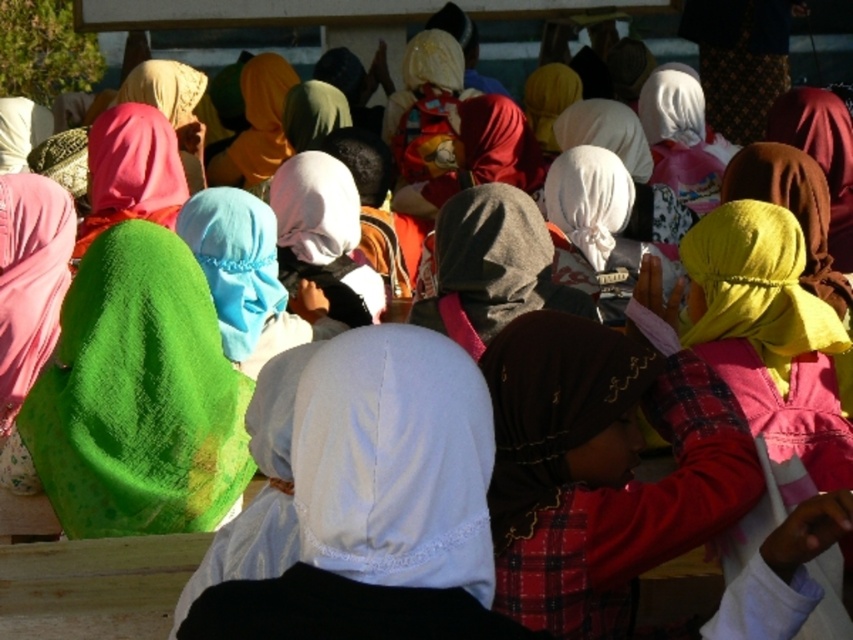
Which is in front, point (38, 406) or point (616, 176)?

Positioned in front is point (38, 406).

Who is more distant from viewer, (236, 481) or (550, 195)?

Positioned behind is point (550, 195).

The image size is (853, 640). In order to click on green textured scarf at center-left in this screenshot , I will do `click(136, 387)`.

Measure the distance between point (390, 564) and camera.

The distance of point (390, 564) from camera is 3.27 meters.

The width and height of the screenshot is (853, 640). Identify the location of white satin hijab at center. pos(366,467).

Does yellow fabric headscarf at right have a smaller size compared to white satin headscarf at center?

Actually, yellow fabric headscarf at right might be larger than white satin headscarf at center.

Does yellow fabric headscarf at right have a larger size compared to white satin headscarf at center?

Correct, yellow fabric headscarf at right is larger in size than white satin headscarf at center.

Where is `yellow fabric headscarf at right`? The height and width of the screenshot is (640, 853). yellow fabric headscarf at right is located at coordinates click(x=759, y=291).